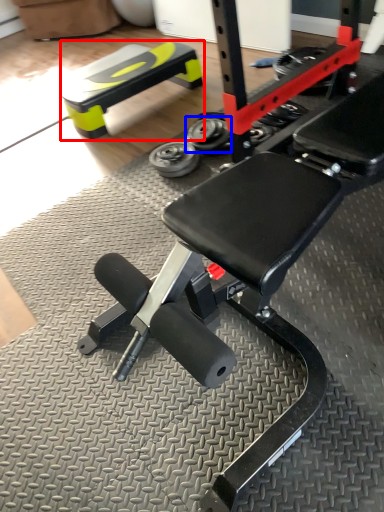
Question: Which point is closer to the camera, bench (highlighted by a red box) or wheel (highlighted by a blue box)?

Choices:
 (A) bench
 (B) wheel

Answer: (B)